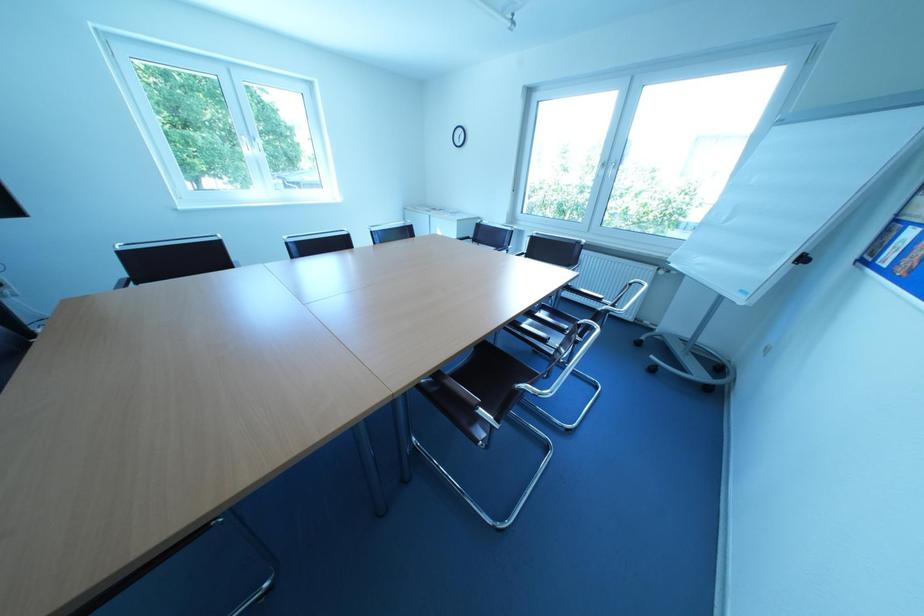
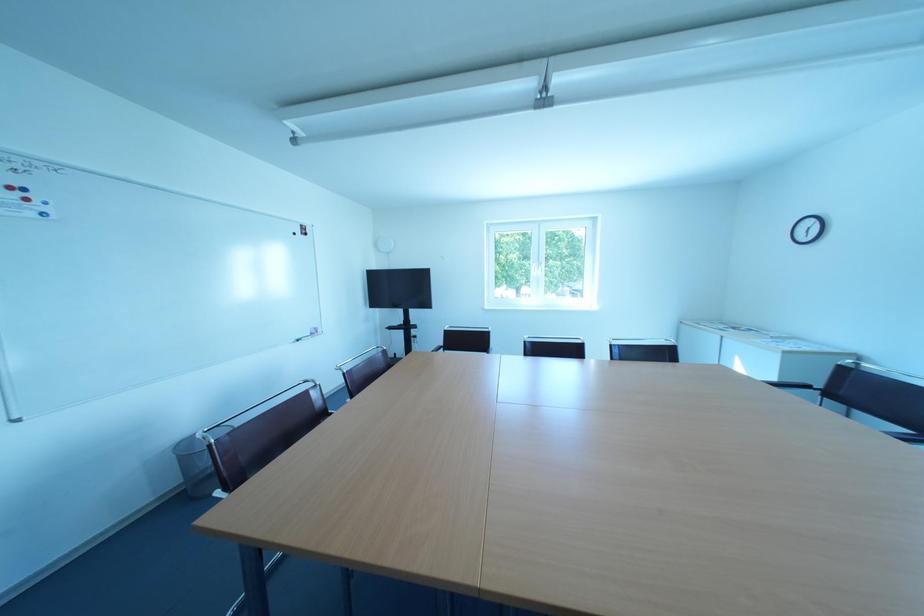
Question: Based on the continuous images, in which direction is the camera rotating? Reply with the corresponding letter.

Choices:
 (A) Left
 (B) Right
 (C) Up
 (D) Down

Answer: (A)